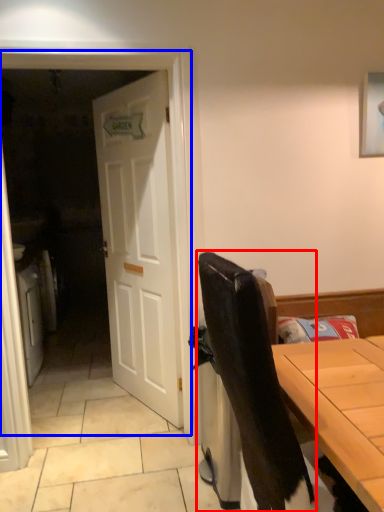
Question: Which of the following is the farthest to the observer, chair (highlighted by a red box) or screen door (highlighted by a blue box)?

Choices:
 (A) chair
 (B) screen door

Answer: (B)